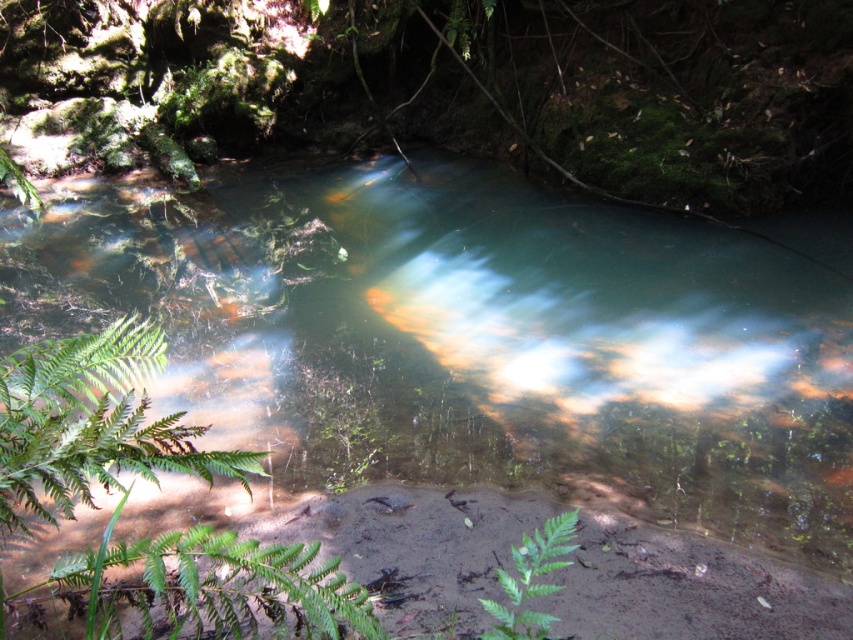
In the scene shown: You are a hiker who wants to cross the stream without getting your boots wet. You see the clear water stream at center and the green leafy fern at lower center. Which object should you step on to cross the stream safely?

You should step on the green leafy fern at lower center because the clear water stream at center is located above it, meaning the fern is on solid ground below the water.

You are standing at the center of the stream and want to reach the green leafy fern at lower left. Which direction should you move to get there?

You should move towards the lower left direction to reach the green leafy fern at lower left since it is located at point (91, 424), which is in the lower left quadrant of the image.

You are a hiker who wants to place a small rock between the green leafy fern at lower left and the green leafy fern at lower center. Based on their positions, where should you place the rock relative to the lower fern?

The green leafy fern at lower left is located above the green leafy fern at lower center, so you should place the rock between them below the green leafy fern at lower left and above the green leafy fern at lower center.